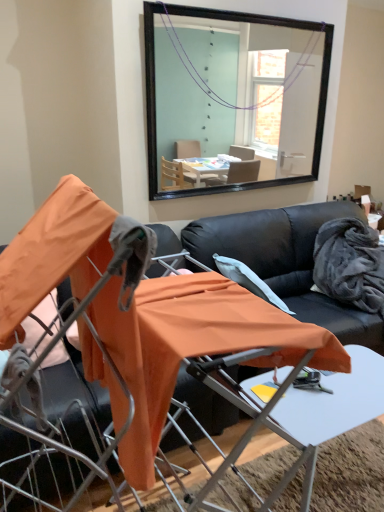
Where is `vacant area on top of orange fabric table at center (from a real-world perspective)`? The width and height of the screenshot is (384, 512). vacant area on top of orange fabric table at center (from a real-world perspective) is located at coordinates (316, 397).